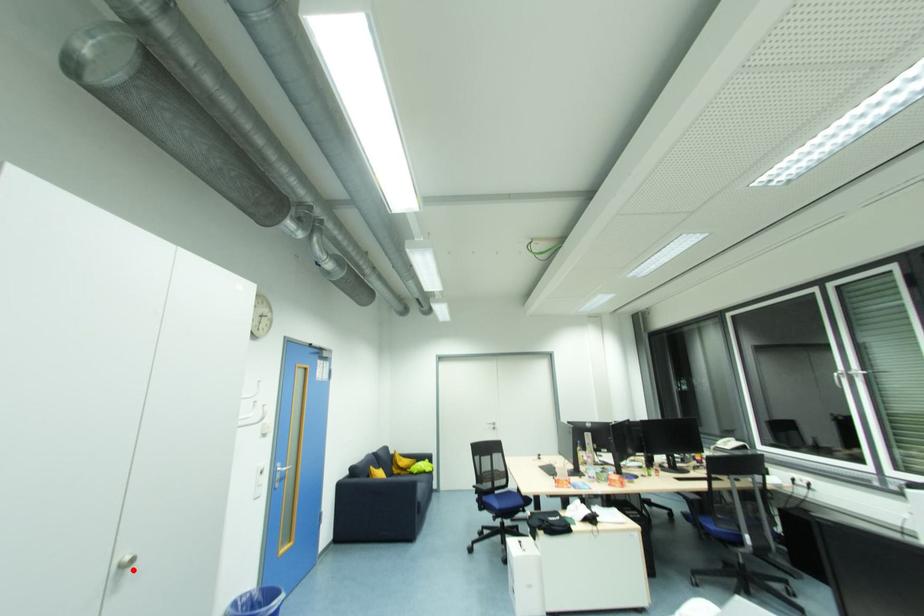
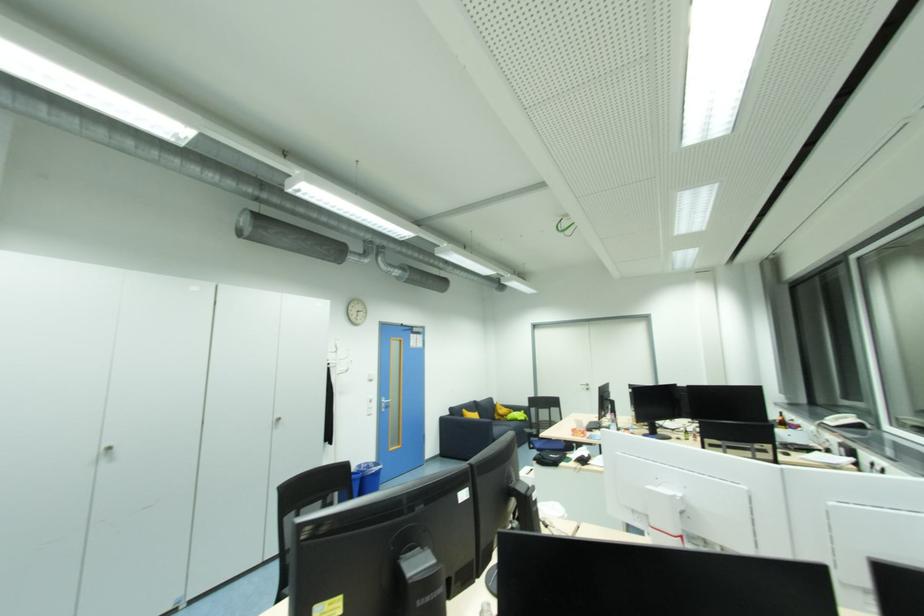
Locate, in the second image, the point that corresponds to the highlighted location in the first image.

(284, 423)